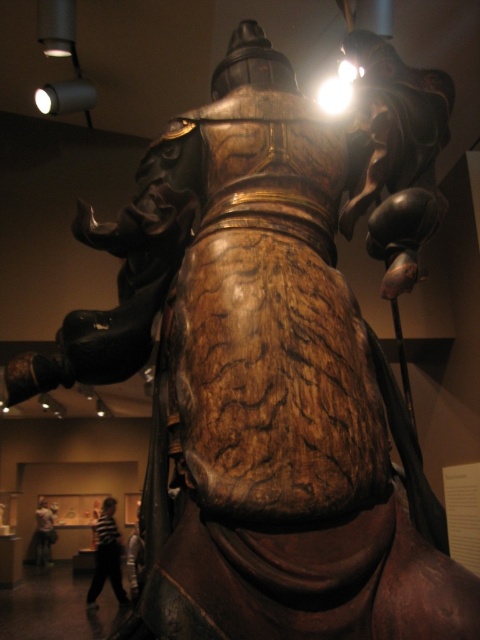
Question: Does striped shirt at lower left come in front of white shirt at lower left?

Choices:
 (A) no
 (B) yes

Answer: (B)

Question: Is striped shirt at lower left thinner than white shirt at lower left?

Choices:
 (A) no
 (B) yes

Answer: (A)

Question: Does striped shirt at lower left appear under white shirt at lower left?

Choices:
 (A) yes
 (B) no

Answer: (B)

Question: Which of the following is the closest to the observer?

Choices:
 (A) striped shirt at lower left
 (B) white shirt at lower left

Answer: (A)